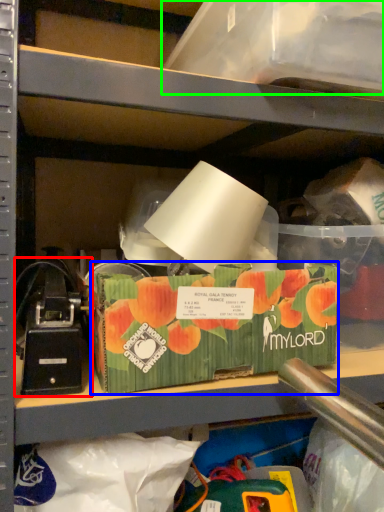
Question: Which object is positioned farthest from toy (highlighted by a red box)? Select from storage box (highlighted by a blue box) and storage box (highlighted by a green box).

Choices:
 (A) storage box
 (B) storage box

Answer: (B)